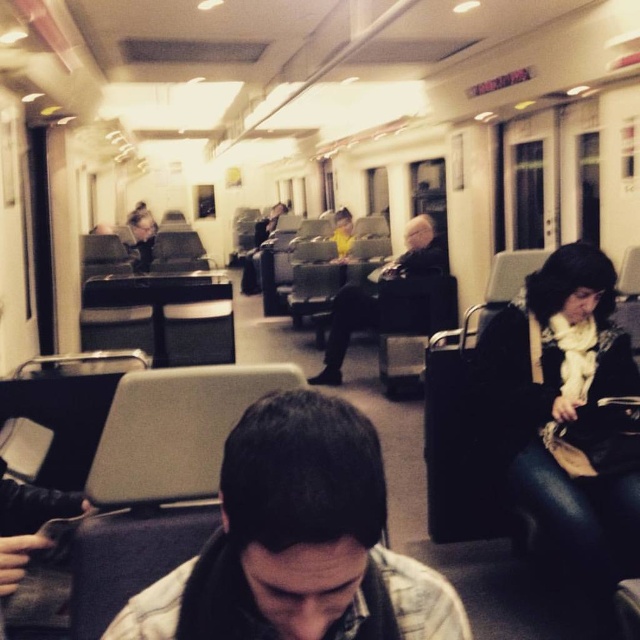
Question: Among these points, which one is nearest to the camera?

Choices:
 (A) (256, 266)
 (B) (579, 436)
 (C) (307, 556)
 (D) (419, 250)

Answer: (C)

Question: Which point is closer to the camera?

Choices:
 (A) dark gray fabric jacket at center
 (B) black leather jacket at right
 (C) matte black jacket at center

Answer: (B)

Question: Is dark gray fabric jacket at center positioned at the back of matte black jacket at center?

Choices:
 (A) no
 (B) yes

Answer: (A)

Question: Which object is positioned closest to the black leather jacket at right?

Choices:
 (A) plaid shirt at center
 (B) matte black jacket at center

Answer: (A)

Question: Does plaid shirt at center lie behind matte black jacket at center?

Choices:
 (A) no
 (B) yes

Answer: (A)

Question: Is black leather jacket at right above matte black jacket at center?

Choices:
 (A) yes
 (B) no

Answer: (B)